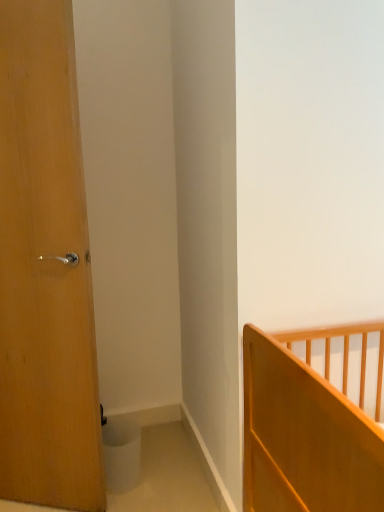
The image size is (384, 512). What do you see at coordinates (45, 269) in the screenshot?
I see `light wood door at left` at bounding box center [45, 269].

Identify the location of light wood door at left. This screenshot has width=384, height=512. (45, 269).

In order to face light wood door at left, should I rotate leftwards or rightwards?

A 21.502 degree turn to the left will do.

What is the approximate width of light brown wooden bed at lower right?

light brown wooden bed at lower right is 27.42 inches wide.

The width and height of the screenshot is (384, 512). What do you see at coordinates (308, 428) in the screenshot? I see `light brown wooden bed at lower right` at bounding box center [308, 428].

Locate an element on the screen. light brown wooden bed at lower right is located at coordinates (308, 428).

Identify the location of light wood door at left. (45, 269).

Considering the relative positions of light wood door at left and light brown wooden bed at lower right in the image provided, is light wood door at left to the right of light brown wooden bed at lower right from the viewer's perspective?

Incorrect, light wood door at left is not on the right side of light brown wooden bed at lower right.

Considering their positions, is light wood door at left located in front of or behind light brown wooden bed at lower right?

light wood door at left is behind light brown wooden bed at lower right.

Between point (58, 338) and point (316, 445), which one is positioned behind?

The point (58, 338) is farther from the camera.

From the image's perspective, is light wood door at left located above or below light brown wooden bed at lower right?

From the image's perspective, light wood door at left appears above light brown wooden bed at lower right.

From a real-world perspective, is light wood door at left above or below light brown wooden bed at lower right?

light wood door at left is above light brown wooden bed at lower right.

Which object is thinner, light wood door at left or light brown wooden bed at lower right?

With smaller width is light wood door at left.

Is light wood door at left shorter than light brown wooden bed at lower right?

No, light wood door at left is not shorter than light brown wooden bed at lower right.

Considering the sizes of objects light wood door at left and light brown wooden bed at lower right in the image provided, who is smaller, light wood door at left or light brown wooden bed at lower right?

light wood door at left is smaller.

Is light wood door at left surrounding light brown wooden bed at lower right?

Actually, light brown wooden bed at lower right is outside light wood door at left.

Are light wood door at left and light brown wooden bed at lower right far apart?

No, light wood door at left is not far from light brown wooden bed at lower right.

Is light wood door at left aimed at light brown wooden bed at lower right?

No, light wood door at left is not oriented towards light brown wooden bed at lower right.

Can you tell me how much light wood door at left and light brown wooden bed at lower right differ in facing direction?

There is a 27.7-degree angle between the facing directions of light wood door at left and light brown wooden bed at lower right.

Measure the distance between light wood door at left and light brown wooden bed at lower right.

The distance of light wood door at left from light brown wooden bed at lower right is 32.10 inches.

This screenshot has height=512, width=384. Find the location of `bed in front of the light wood door at left`. bed in front of the light wood door at left is located at coordinates (308, 428).

Is light brown wooden bed at lower right to the left or to the right of light wood door at left in the image?

light brown wooden bed at lower right is to the right of light wood door at left.

Does light brown wooden bed at lower right come in front of light wood door at left?

Yes, light brown wooden bed at lower right is closer to the viewer.

Does point (263, 480) appear closer or farther from the camera than point (10, 374)?

Point (263, 480) appears to be closer to the viewer than point (10, 374).

From the image's perspective, does light brown wooden bed at lower right appear higher than light wood door at left?

No.

From a real-world perspective, who is located higher, light brown wooden bed at lower right or light wood door at left?

From a 3D spatial view, light wood door at left is above.

Considering the sizes of objects light brown wooden bed at lower right and light wood door at left in the image provided, who is thinner, light brown wooden bed at lower right or light wood door at left?

light wood door at left.

Between light brown wooden bed at lower right and light wood door at left, which one has less height?

With less height is light brown wooden bed at lower right.

Which of these two, light brown wooden bed at lower right or light wood door at left, is bigger?

light brown wooden bed at lower right is bigger.

Is light brown wooden bed at lower right surrounding light wood door at left?

No, light wood door at left is not surrounded by light brown wooden bed at lower right.

Is light brown wooden bed at lower right touching light wood door at left?

No, light brown wooden bed at lower right is not with light wood door at left.

Is light brown wooden bed at lower right aimed at light wood door at left?

No, light brown wooden bed at lower right is not oriented towards light wood door at left.

Measure the distance between light brown wooden bed at lower right and light wood door at left.

light brown wooden bed at lower right is 32.10 inches away from light wood door at left.

The height and width of the screenshot is (512, 384). In order to click on bed that appears below the light wood door at left (from a real-world perspective) in this screenshot , I will do `click(308, 428)`.

Image resolution: width=384 pixels, height=512 pixels. I want to click on bed directly beneath the light wood door at left (from a real-world perspective), so click(308, 428).

Identify the location of bed in front of the light wood door at left. (308, 428).